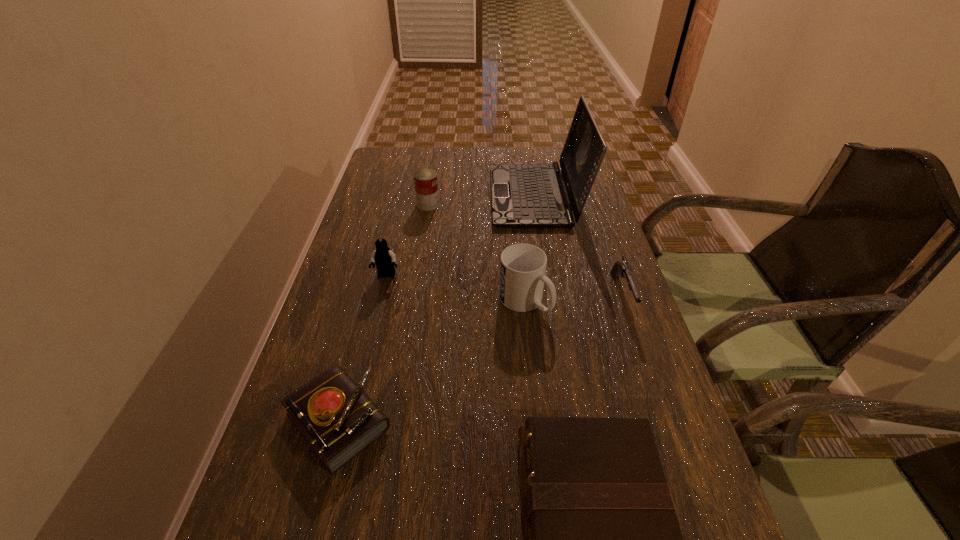
Identify the location of vacant space located 0.320m on the front-facing side of the Lego. This screenshot has width=960, height=540. (359, 392).

The height and width of the screenshot is (540, 960). I want to click on free region located 0.270m on the front label of the can, so click(526, 205).

At what (x,y) coordinates should I click in order to perform the action: click on vacant region located 0.050m aiming along the barrel of the gun. Please return your answer as a coordinate pair (x, y). Looking at the image, I should click on (637, 341).

Where is `free space located on the right of the shortest object`? This screenshot has height=540, width=960. free space located on the right of the shortest object is located at coordinates (484, 421).

The image size is (960, 540). What are the coordinates of `object that is at the far edge` in the screenshot? It's located at (524, 195).

At what (x,y) coordinates should I click in order to perform the action: click on Lego that is at the left edge. Please return your answer as a coordinate pair (x, y). The height and width of the screenshot is (540, 960). Looking at the image, I should click on (384, 258).

The image size is (960, 540). Find the location of `diary that is at the left edge`. diary that is at the left edge is located at coordinates [335, 416].

This screenshot has width=960, height=540. Identify the location of laptop computer located in the right edge section of the desktop. click(x=524, y=195).

Find the location of a particular element. The height and width of the screenshot is (540, 960). gun situated at the right edge is located at coordinates (622, 267).

You are a GUI agent. You are given a task and a screenshot of the screen. Output one action in this format:
    pyautogui.click(x=<x>, y=<y>)
    Task: Click on the object that is at the far right corner
    
    Given the screenshot: What is the action you would take?
    pyautogui.click(x=524, y=195)